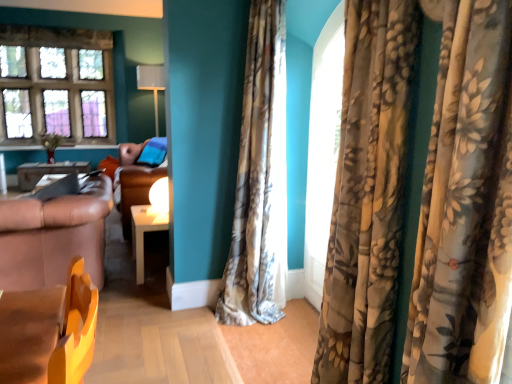
Question: Is white glossy table at center, marked as the 2th table in a left-to-right arrangement, at the right side of stained glass window at upper left?

Choices:
 (A) yes
 (B) no

Answer: (A)

Question: Is white glossy table at center, placed as the 2th table when sorted from top to bottom, bigger than stained glass window at upper left?

Choices:
 (A) yes
 (B) no

Answer: (B)

Question: Is white glossy table at center, which is counted as the second table, starting from the back, taller than stained glass window at upper left?

Choices:
 (A) yes
 (B) no

Answer: (B)

Question: Does white glossy table at center, which is the first table from front to back, have a lesser height compared to stained glass window at upper left?

Choices:
 (A) yes
 (B) no

Answer: (A)

Question: Is white glossy table at center, placed as the 2th table when sorted from top to bottom, closer to the viewer compared to stained glass window at upper left?

Choices:
 (A) yes
 (B) no

Answer: (A)

Question: Do you think floral silk curtain at center, the 1th curtain positioned from the left, is within floral velvet curtains at right, which is the 1th curtain in front-to-back order, or outside of it?

Choices:
 (A) outside
 (B) inside

Answer: (A)

Question: From the image's perspective, relative to floral velvet curtains at right, the first curtain positioned from the right, is floral silk curtain at center, arranged as the 1th curtain when viewed from the back, above or below?

Choices:
 (A) below
 (B) above

Answer: (B)

Question: Relative to floral velvet curtains at right, placed as the second curtain when sorted from back to front, is floral silk curtain at center, the second curtain when ordered from right to left, in front or behind?

Choices:
 (A) front
 (B) behind

Answer: (B)

Question: In terms of size, does floral silk curtain at center, the second curtain when ordered from right to left, appear bigger or smaller than floral velvet curtains at right, placed as the second curtain when sorted from back to front?

Choices:
 (A) big
 (B) small

Answer: (A)

Question: Based on their positions, is metallic silver table at left, which ranks as the first table in left-to-right order, located to the left or right of floral velvet curtains at right, the first curtain positioned from the right?

Choices:
 (A) left
 (B) right

Answer: (A)

Question: From a real-world perspective, is metallic silver table at left, acting as the first table starting from the top, positioned above or below floral velvet curtains at right, the first curtain positioned from the right?

Choices:
 (A) above
 (B) below

Answer: (B)

Question: Is metallic silver table at left, the 2th table positioned from the right, in front of or behind floral velvet curtains at right, placed as the second curtain when sorted from back to front, in the image?

Choices:
 (A) front
 (B) behind

Answer: (B)

Question: Is point (54, 173) closer or farther from the camera than point (470, 29)?

Choices:
 (A) closer
 (B) farther

Answer: (B)

Question: Do you think floral fabric curtain at right is within white glossy lampshade at upper center, or outside of it?

Choices:
 (A) outside
 (B) inside

Answer: (A)

Question: Would you say floral fabric curtain at right is to the left or to the right of white glossy lampshade at upper center in the picture?

Choices:
 (A) right
 (B) left

Answer: (A)